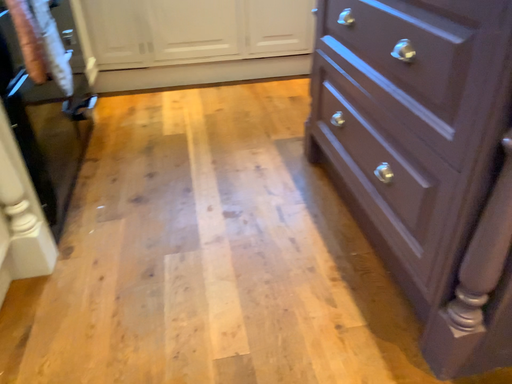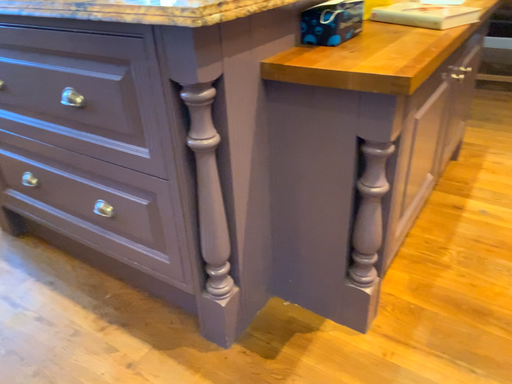
Question: How did the camera likely rotate when shooting the video?

Choices:
 (A) rotated downward
 (B) rotated upward

Answer: (B)